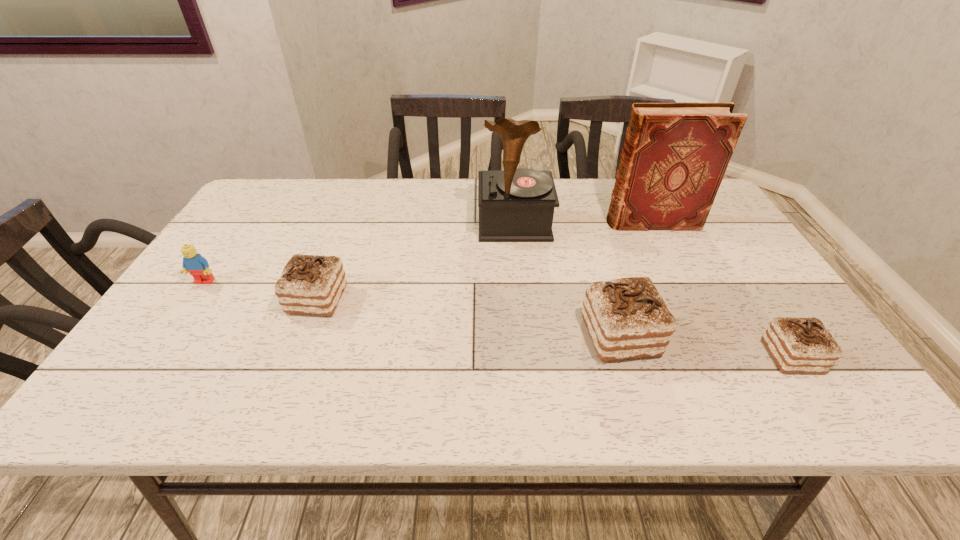
You are a GUI agent. You are given a task and a screenshot of the screen. Output one action in this format:
    pyautogui.click(x=<x>, y=<y>)
    Task: Click on the free space between the second chocolate cake from right to left and the shortest object
    
    Given the screenshot: What is the action you would take?
    pyautogui.click(x=706, y=346)

I want to click on free space between the fourth object from right to left and the tallest chocolate cake, so click(567, 280).

Locate an element on the screen. Image resolution: width=960 pixels, height=540 pixels. vacant space that is in between the rightmost chocolate cake and the second object from left to right is located at coordinates (555, 328).

Image resolution: width=960 pixels, height=540 pixels. In order to click on free space between the second object from left to right and the hardback book in this screenshot , I will do `click(485, 261)`.

This screenshot has height=540, width=960. Find the location of `blank region between the leftmost object and the hardback book`. blank region between the leftmost object and the hardback book is located at coordinates (428, 252).

Where is `vacant point located between the rightmost chocolate cake and the leftmost object`? The image size is (960, 540). vacant point located between the rightmost chocolate cake and the leftmost object is located at coordinates (498, 319).

Image resolution: width=960 pixels, height=540 pixels. I want to click on free space between the leftmost chocolate cake and the fourth object from right to left, so click(x=416, y=262).

Find the location of a particular element. This screenshot has width=960, height=540. object that stands as the third closest to the shortest chocolate cake is located at coordinates (x=515, y=205).

You are a GUI agent. You are given a task and a screenshot of the screen. Output one action in this format:
    pyautogui.click(x=<x>, y=<y>)
    Task: Click on the object identified as the third closest to the second tallest chocolate cake
    
    Given the screenshot: What is the action you would take?
    pyautogui.click(x=626, y=318)

Image resolution: width=960 pixels, height=540 pixels. Find the location of `chocolate cake that is the second closest to the leftmost chocolate cake`. chocolate cake that is the second closest to the leftmost chocolate cake is located at coordinates (797, 345).